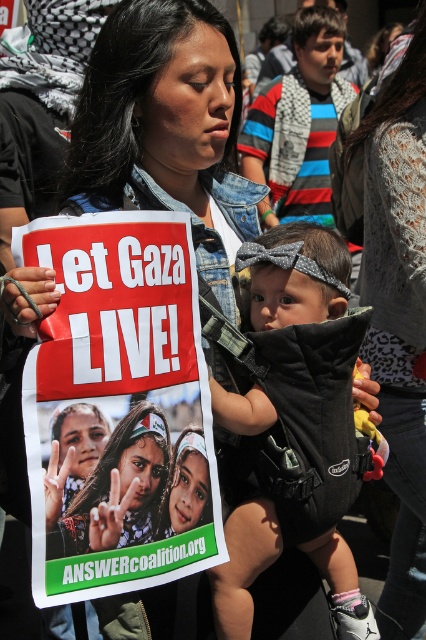
You are a photographer standing 1.5 meters away from the white paper poster at center. You want to take a closeup shot of the poster without moving your position. Is it possible to do so with a standard camera lens that has a minimum focusing distance of 1.5 meters?

The white paper poster at center is 1.69 meters away from the viewer. Since the minimum focusing distance of the camera lens is 1.5 meters, the photographer can take a closeup shot without moving because the poster is beyond the minimum required distance.

You are a photographer at the protest and want to capture the white paper poster at center and the black fabric baby carrier at center in a single frame. Which object is positioned lower in the image?

The white paper poster at center is located below the black fabric baby carrier at center, so it is positioned lower in the image.